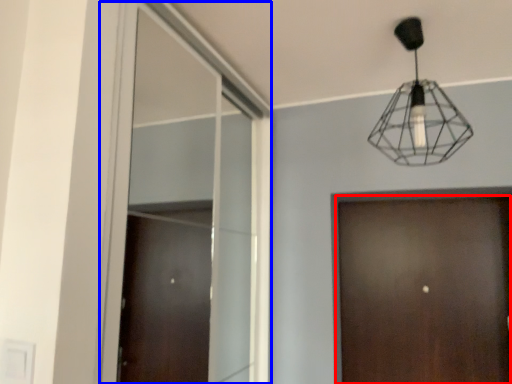
Question: Which of the following is the closest to the observer, door (highlighted by a red box) or window (highlighted by a blue box)?

Choices:
 (A) door
 (B) window

Answer: (B)